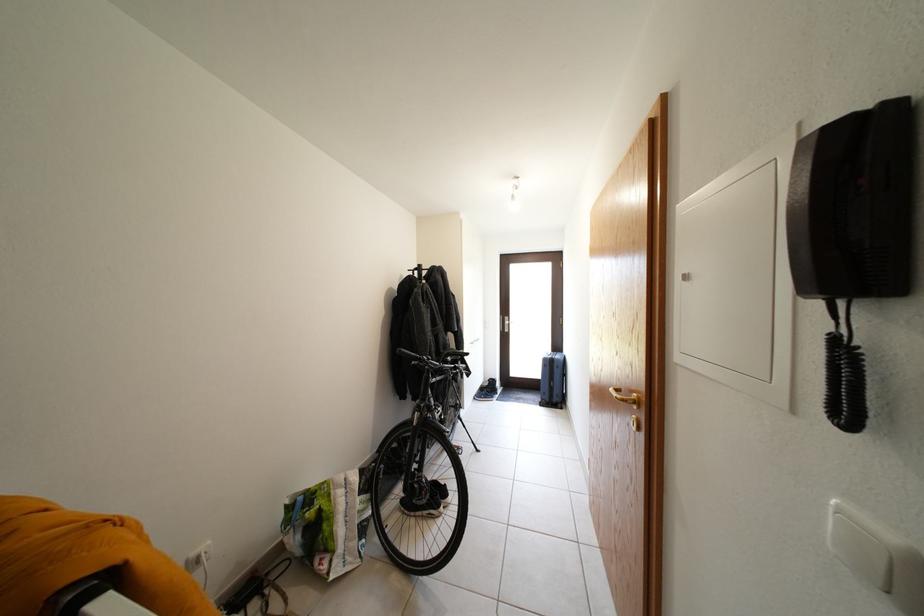
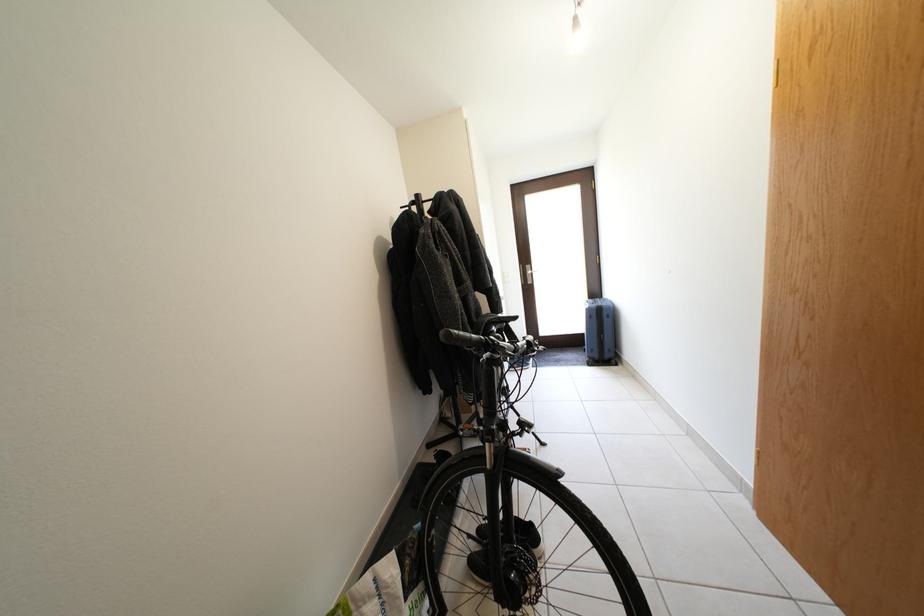
The images are taken continuously from a first-person perspective. In which direction are you moving?

The cameraman walked toward left, forward.